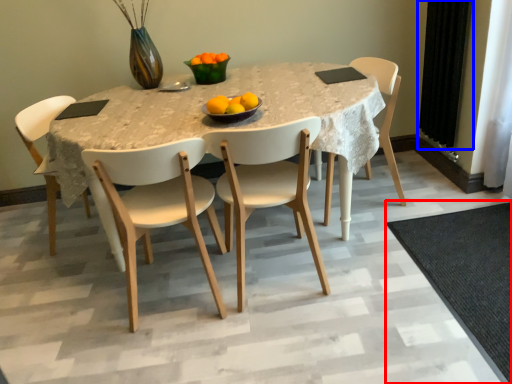
Question: Which object is further to the camera taking this photo, mat (highlighted by a red box) or curtain (highlighted by a blue box)?

Choices:
 (A) mat
 (B) curtain

Answer: (B)